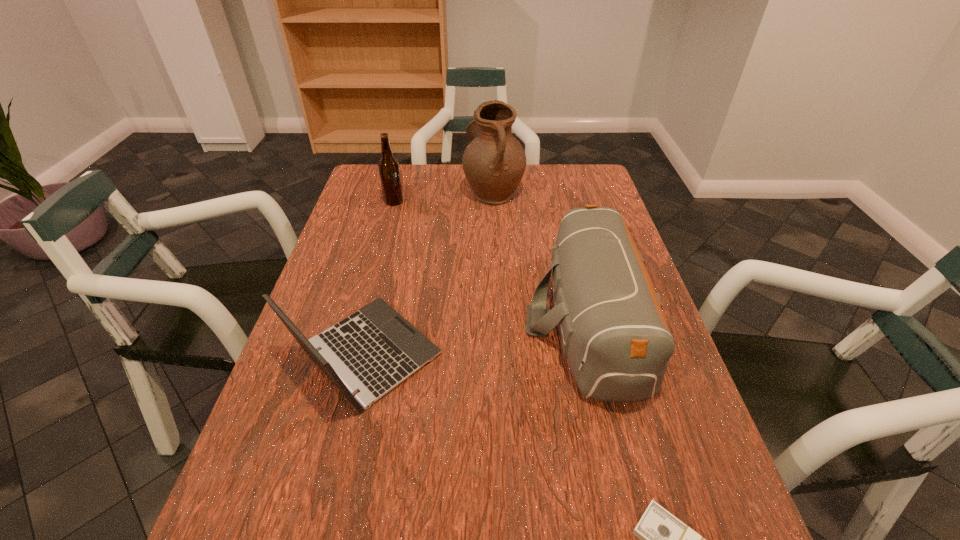
What are the coordinates of `vacant space at the far right corner of the desktop` in the screenshot? It's located at coord(587,182).

I want to click on empty space that is in between the beer bottle and the pitcher, so click(444, 197).

Identify the location of vacant space that is in between the beer bottle and the duffel bag. pos(491,262).

Locate an element on the screen. The image size is (960, 540). unoccupied position between the beer bottle and the laptop_computer is located at coordinates (380, 278).

At what (x,y) coordinates should I click in order to perform the action: click on empty location between the beer bottle and the pitcher. Please return your answer as a coordinate pair (x, y). The image size is (960, 540). Looking at the image, I should click on (444, 197).

Where is `vacant region between the laptop_computer and the pitcher`? vacant region between the laptop_computer and the pitcher is located at coordinates (429, 273).

This screenshot has width=960, height=540. I want to click on vacant space that is in between the tallest object and the duffel bag, so click(540, 256).

At what (x,y) coordinates should I click in order to perform the action: click on free area in between the laptop_computer and the duffel bag. Please return your answer as a coordinate pair (x, y). The image size is (960, 540). Looking at the image, I should click on (476, 338).

Image resolution: width=960 pixels, height=540 pixels. What are the coordinates of `free space that is in between the pitcher and the laptop_computer` in the screenshot? It's located at (429, 273).

Point out which object is positioned as the fourth nearest to the laptop_computer. Please provide its 2D coordinates. Your answer should be formatted as a tuple, i.e. [(x, y)], where the tuple contains the x and y coordinates of a point satisfying the conditions above.

[(389, 171)]